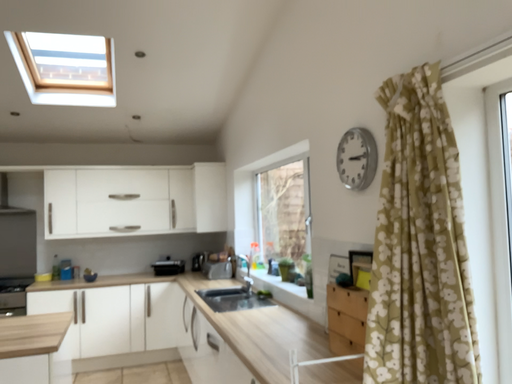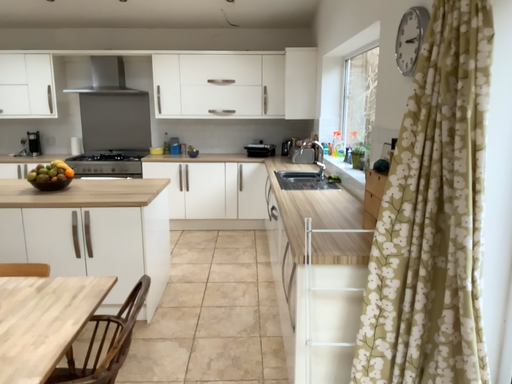
Question: Which way did the camera rotate in the video?

Choices:
 (A) rotated left
 (B) rotated right

Answer: (A)